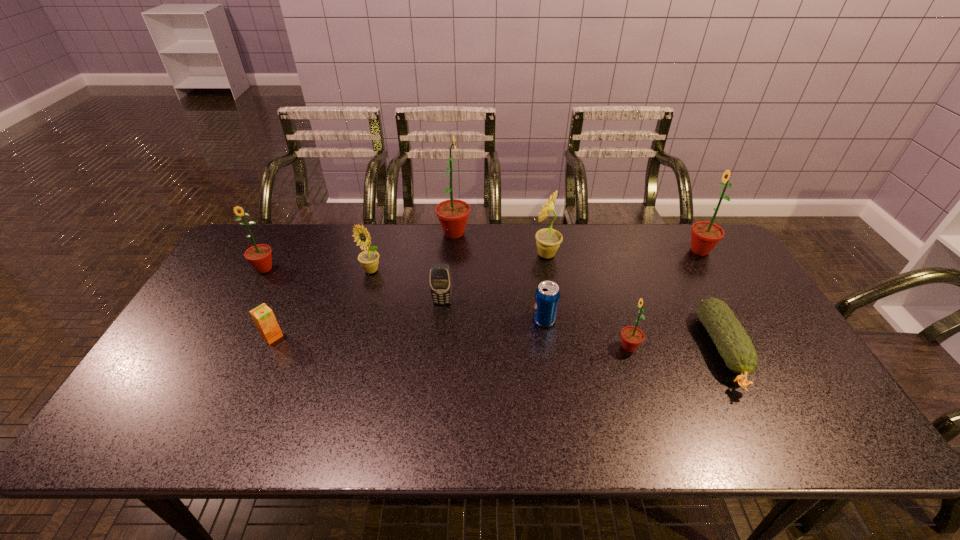
Locate an element on the screen. vacant space located 0.220m on the face of the second tallest object is located at coordinates (619, 251).

Where is `vacant space located on the face of the third sunflower from right to left`? This screenshot has width=960, height=540. vacant space located on the face of the third sunflower from right to left is located at coordinates (415, 254).

In order to click on vacant space situated 0.210m on the face of the third sunflower from right to left in this screenshot , I will do `click(468, 254)`.

In order to click on free space located 0.360m on the face of the third sunflower from right to left in this screenshot , I will do `click(423, 254)`.

I want to click on free location located on the face of the second nearest green sunflower, so click(211, 366).

I want to click on vacant area located on the face of the nearest sunflower, so click(504, 347).

I want to click on vacant space located 0.170m on the face of the nearest sunflower, so click(x=553, y=347).

The image size is (960, 540). I want to click on vacant space located 0.400m on the face of the nearest sunflower, so click(467, 347).

This screenshot has width=960, height=540. I want to click on vacant region located 0.260m on the face of the fifth sunflower from right to left, so click(350, 343).

Locate an element on the screen. Image resolution: width=960 pixels, height=540 pixels. free space located on the front face of the sixth farthest object is located at coordinates pos(438,355).